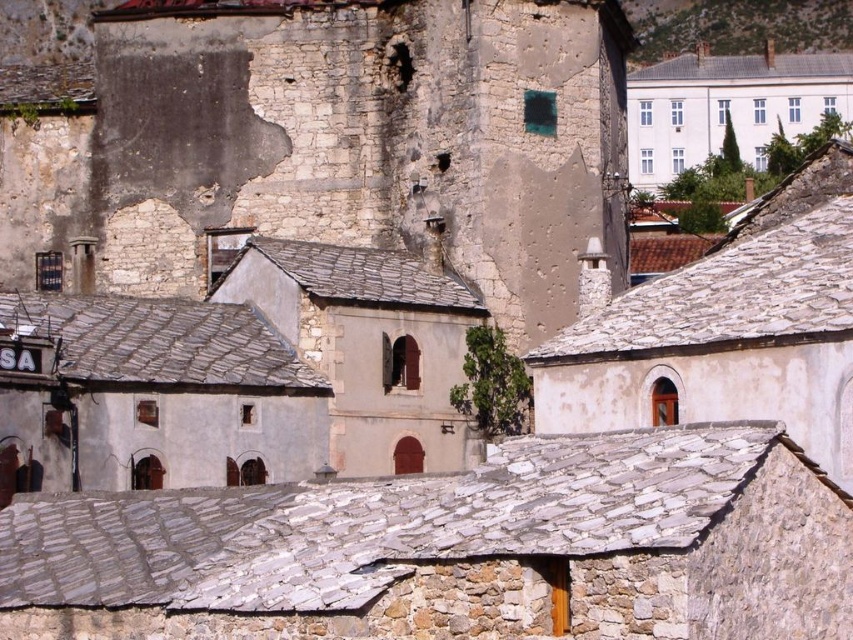
You are an architect planning to install a solar panel system on the white smooth building at upper right and the green mossy hillside at upper right. Based on their heights, which location would allow for better sunlight exposure?

The green mossy hillside at upper right is taller than the white smooth building at upper right, so installing solar panels there would likely provide better sunlight exposure as it is higher and less obstructed by surrounding structures.

You are a tourist standing in front of the old stone buildings. You notice two structures at the upper right corner of the image. One is the white smooth building at upper right and the other is the green mossy hillside at upper right. Which one appears narrower from your viewpoint?

The white smooth building at upper right is thinner than the green mossy hillside at upper right, so it appears narrower from your viewpoint.

You are standing at the base of the green mossy hillside at upper right and want to reach the white smooth building at upper right. Which direction should you move to get there?

The white smooth building at upper right is below the green mossy hillside at upper right, so you should move downward to reach it.